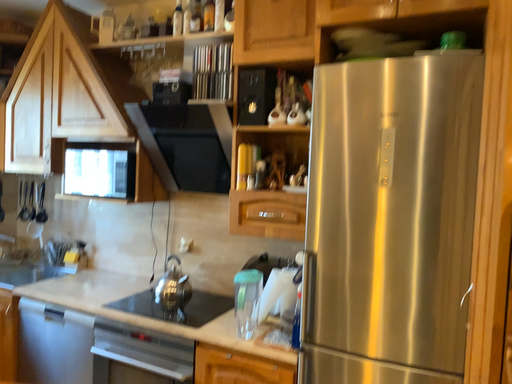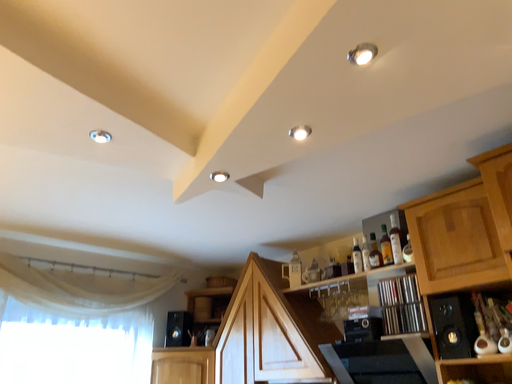
Question: How did the camera likely rotate when shooting the video?

Choices:
 (A) rotated right
 (B) rotated left

Answer: (B)